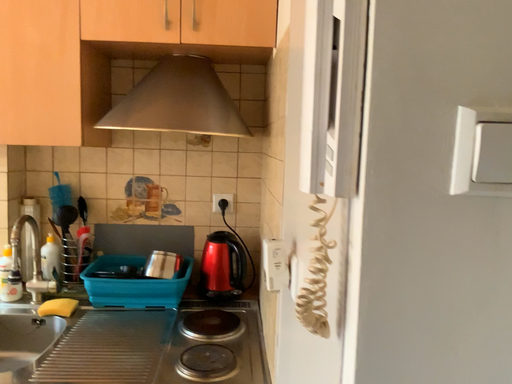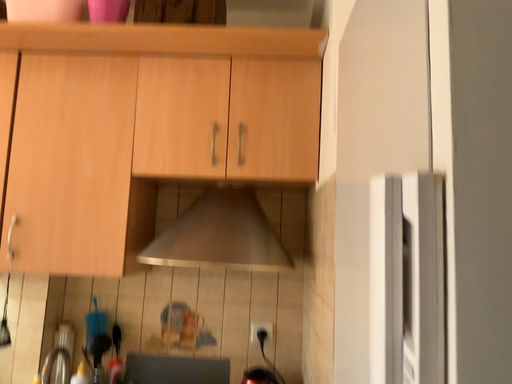
Question: How did the camera likely rotate when shooting the video?

Choices:
 (A) rotated upward
 (B) rotated downward

Answer: (A)